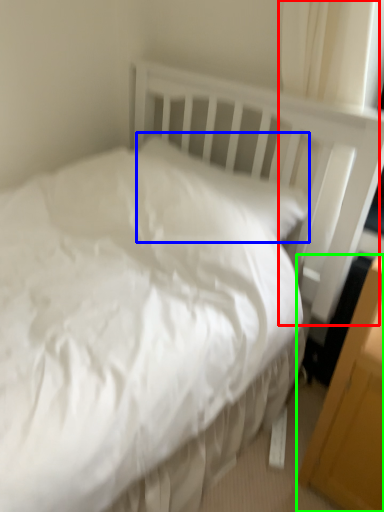
Question: Estimate the real-world distances between objects in this image. Which object is closer to curtain (highlighted by a red box), pillow (highlighted by a blue box) or file cabinet (highlighted by a green box)?

Choices:
 (A) pillow
 (B) file cabinet

Answer: (A)